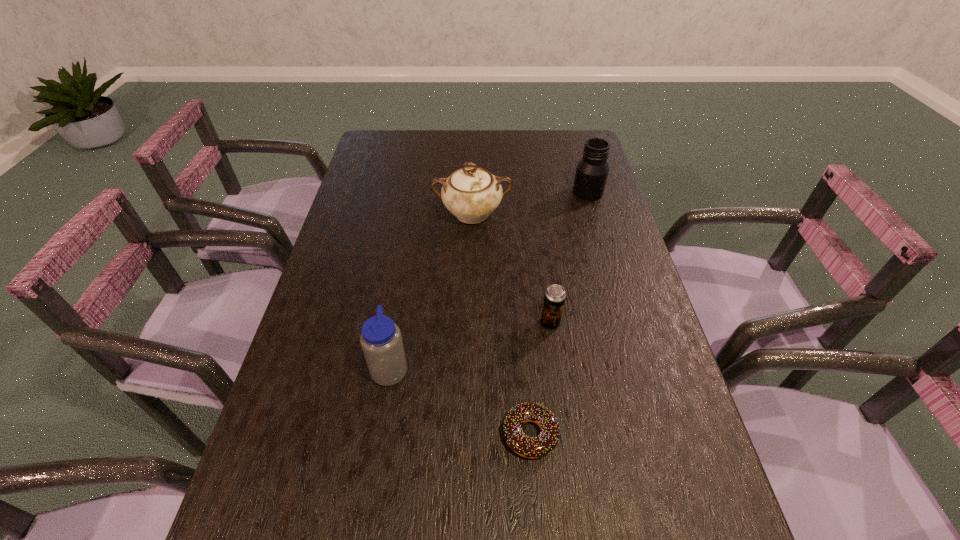
This screenshot has width=960, height=540. What are the coordinates of `chinaware` in the screenshot? It's located at (471, 194).

This screenshot has width=960, height=540. Identify the location of the rightmost object. (592, 170).

Where is `the second nearest object`? The width and height of the screenshot is (960, 540). the second nearest object is located at coordinates (381, 341).

The image size is (960, 540). Identify the location of the leftmost object. (381, 341).

Image resolution: width=960 pixels, height=540 pixels. In order to click on the third farthest object in this screenshot , I will do `click(554, 300)`.

Find the location of a particular element. The height and width of the screenshot is (540, 960). beer can is located at coordinates [554, 300].

Identify the location of the nearest object. Image resolution: width=960 pixels, height=540 pixels. (540, 446).

You are a GUI agent. You are given a task and a screenshot of the screen. Output one action in this format:
    pyautogui.click(x=<x>, y=<y>)
    Task: Click on the doughnut
    
    Given the screenshot: What is the action you would take?
    pyautogui.click(x=540, y=446)

I want to click on vacant space located on the front of the chinaware, so click(470, 294).

I want to click on blank space located on the left of the jar, so click(x=523, y=192).